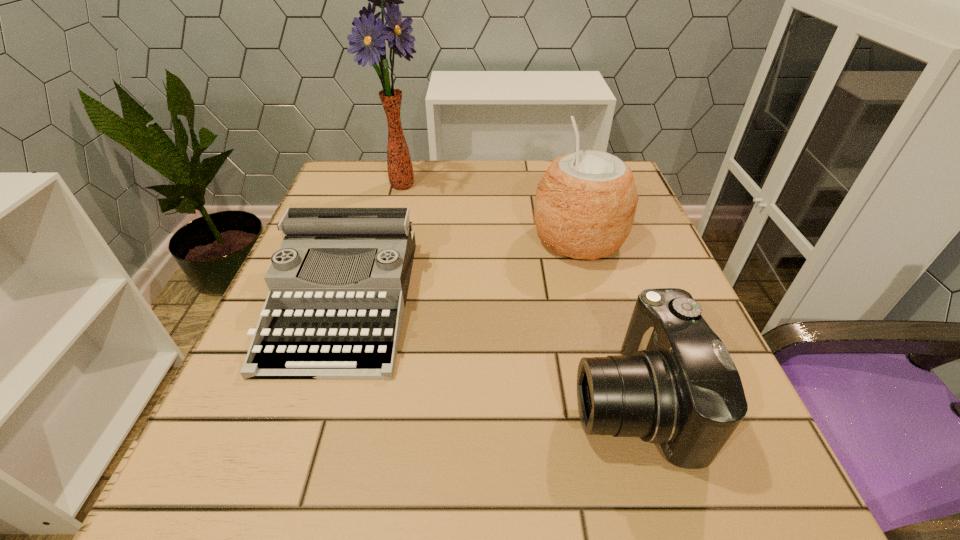
Identify the location of vacant space situated 0.120m on the typing side of the shortest object. (294, 455).

The height and width of the screenshot is (540, 960). I want to click on object present at the far edge, so click(368, 39).

This screenshot has width=960, height=540. I want to click on object located at the near edge, so click(x=675, y=384).

Image resolution: width=960 pixels, height=540 pixels. What are the coordinates of `flower arrangement that is at the left edge` in the screenshot? It's located at (368, 39).

Find the location of a particular element. typewriter positioned at the left edge is located at coordinates (338, 285).

At what (x,y) coordinates should I click in order to perform the action: click on coconut present at the right edge. Please return your answer as a coordinate pair (x, y). The image size is (960, 540). Looking at the image, I should click on (585, 205).

Identify the location of camera that is at the right edge. The image size is (960, 540). (675, 384).

The image size is (960, 540). I want to click on object at the far left corner, so click(368, 39).

You are a GUI agent. You are given a task and a screenshot of the screen. Output one action in this format:
    pyautogui.click(x=<x>, y=<y>)
    Task: Click on the object at the near right corner
    
    Given the screenshot: What is the action you would take?
    pyautogui.click(x=675, y=384)

Identify the location of vacant space at the far edge of the desktop. This screenshot has width=960, height=540. (529, 205).